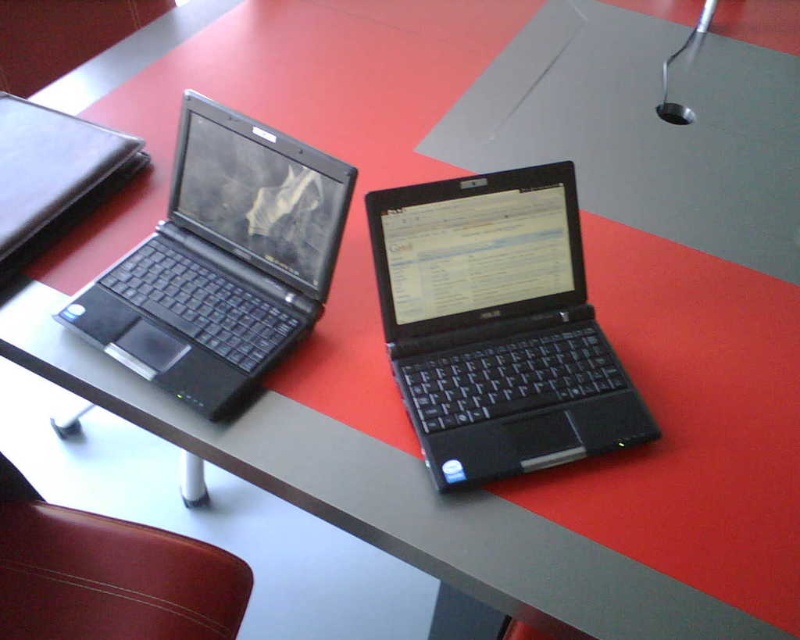
Question: Is black plastic laptop at center above leather at lower left?

Choices:
 (A) no
 (B) yes

Answer: (B)

Question: Can you confirm if black plastic laptop at center is positioned to the left of matte black laptop at left?

Choices:
 (A) yes
 (B) no

Answer: (B)

Question: Which point is farther to the camera?

Choices:
 (A) (578, 456)
 (B) (166, 301)

Answer: (B)

Question: Which object is positioned farthest from the matte black laptop at left?

Choices:
 (A) leather at lower left
 (B) black plastic laptop at center

Answer: (A)

Question: Does matte black laptop at left have a smaller size compared to leather at lower left?

Choices:
 (A) yes
 (B) no

Answer: (B)

Question: Which point is closer to the camera?

Choices:
 (A) black plastic laptop at center
 (B) leather at lower left

Answer: (A)